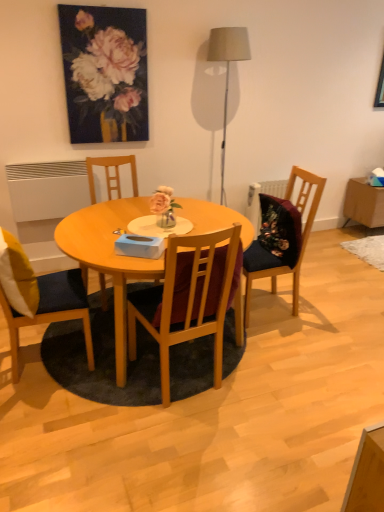
At what (x,y) coordinates should I click in order to perform the action: click on wooden chair at center, which appears as the third chair when viewed from the left. Please return your answer as a coordinate pair (x, y). Looking at the image, I should click on (187, 301).

Describe the element at coordinates (227, 69) in the screenshot. I see `matte gray floor lamp at upper center` at that location.

Locate an element on the screen. Image resolution: width=384 pixels, height=512 pixels. white matte radiator at lower left is located at coordinates (47, 189).

In order to face yellow fabric pillow at left, should I rotate leftwards or rightwards?

Rotate your view left by about 22.286°.

The image size is (384, 512). Describe the element at coordinates (109, 258) in the screenshot. I see `light brown wooden table at center` at that location.

At what (x,y) coordinates should I click in order to perform the action: click on wooden chair at center, which appears as the third chair when viewed from the left. Please return your answer as a coordinate pair (x, y). Looking at the image, I should click on (187, 301).

Is dark blue fabric chair at center, the fourth chair viewed from the left, in front of or behind matte gray floor lamp at upper center in the image?

dark blue fabric chair at center, the fourth chair viewed from the left, is in front of matte gray floor lamp at upper center.

From the picture: From the image's perspective, is dark blue fabric chair at center, acting as the first chair starting from the right, below matte gray floor lamp at upper center?

Correct, dark blue fabric chair at center, acting as the first chair starting from the right, appears lower than matte gray floor lamp at upper center in the image.

Can we say dark blue fabric chair at center, the fourth chair viewed from the left, lies outside matte gray floor lamp at upper center?

Indeed, dark blue fabric chair at center, the fourth chair viewed from the left, is completely outside matte gray floor lamp at upper center.

From a real-world perspective, is dark blue fabric chair at center, acting as the first chair starting from the right, located higher than matte gray floor lamp at upper center?

Actually, dark blue fabric chair at center, acting as the first chair starting from the right, is physically below matte gray floor lamp at upper center in the real world.

Is light brown wooden table at center outside of matte gray floor lamp at upper center?

Yes, light brown wooden table at center is located beyond the bounds of matte gray floor lamp at upper center.

Could you tell me if light brown wooden table at center is facing matte gray floor lamp at upper center?

No, light brown wooden table at center is not aimed at matte gray floor lamp at upper center.

From a real-world perspective, is light brown wooden table at center physically located above or below matte gray floor lamp at upper center?

light brown wooden table at center is situated lower than matte gray floor lamp at upper center in the real world.

Can you confirm if light brown wooden table at center is smaller than matte gray floor lamp at upper center?

No, light brown wooden table at center is not smaller than matte gray floor lamp at upper center.

Measure the distance between dark blue fabric chair at center, acting as the first chair starting from the right, and oil painting at upper center.

dark blue fabric chair at center, acting as the first chair starting from the right, and oil painting at upper center are 5.03 feet apart from each other.

Is dark blue fabric chair at center, acting as the first chair starting from the right, oriented away from oil painting at upper center?

dark blue fabric chair at center, acting as the first chair starting from the right, does not have its back to oil painting at upper center.

Can you confirm if dark blue fabric chair at center, acting as the first chair starting from the right, is positioned to the right of oil painting at upper center?

Yes, dark blue fabric chair at center, acting as the first chair starting from the right, is to the right of oil painting at upper center.

From a real-world perspective, is dark blue fabric chair at center, the fourth chair viewed from the left, under oil painting at upper center?

Indeed, from a real-world perspective, dark blue fabric chair at center, the fourth chair viewed from the left, is positioned beneath oil painting at upper center.

Is matte gray floor lamp at upper center thinner than wooden chair at center, which appears as the third chair when viewed from the left?

Indeed, matte gray floor lamp at upper center has a lesser width compared to wooden chair at center, which appears as the third chair when viewed from the left.

Is matte gray floor lamp at upper center positioned far away from wooden chair at center, the 2th chair when ordered from right to left?

matte gray floor lamp at upper center is positioned a significant distance from wooden chair at center, the 2th chair when ordered from right to left.

I want to click on the 4th chair positioned below the matte gray floor lamp at upper center (from the image's perspective), so click(x=187, y=301).

From a real-world perspective, who is located higher, matte gray floor lamp at upper center or wooden chair at center, which appears as the third chair when viewed from the left?

From a 3D spatial view, matte gray floor lamp at upper center is above.

From the picture: From a real-world perspective, who is located higher, yellow fabric pillow at left or oil painting at upper center?

oil painting at upper center, from a real-world perspective.

Is yellow fabric pillow at left directly adjacent to oil painting at upper center?

No, yellow fabric pillow at left is not touching oil painting at upper center.

Could you tell me if yellow fabric pillow at left is turned towards oil painting at upper center?

No, yellow fabric pillow at left is not turned towards oil painting at upper center.

Which is correct: matte gray floor lamp at upper center is inside dark blue fabric chair at center, the fourth chair viewed from the left, or outside of it?

matte gray floor lamp at upper center is located beyond the bounds of dark blue fabric chair at center, the fourth chair viewed from the left.

What's the angular difference between matte gray floor lamp at upper center and dark blue fabric chair at center, the fourth chair viewed from the left,'s facing directions?

90.7 degrees.

From the image's perspective, is matte gray floor lamp at upper center over dark blue fabric chair at center, the fourth chair viewed from the left?

Yes, from the image's perspective, matte gray floor lamp at upper center is on top of dark blue fabric chair at center, the fourth chair viewed from the left.

From the image's perspective, starting from the matte gray floor lamp at upper center, which chair is the 2nd one below? Please provide its 2D coordinates.

[(300, 240)]

Is oil painting at upper center situated inside wooden side table at right or outside?

oil painting at upper center is outside wooden side table at right.

Is oil painting at upper center beside wooden side table at right?

No, oil painting at upper center is not beside wooden side table at right.

Considering the positions of points (77, 57) and (360, 199), is point (77, 57) farther from camera compared to point (360, 199)?

That is False.

Relative to wooden side table at right, is oil painting at upper center in front or behind?

Clearly, oil painting at upper center is in front of wooden side table at right.

The width and height of the screenshot is (384, 512). In order to click on the 2nd chair below the matte gray floor lamp at upper center (from the image's perspective) in this screenshot , I will do `click(300, 240)`.

Find the location of a particular element. The width and height of the screenshot is (384, 512). desk in front of the matte gray floor lamp at upper center is located at coordinates (109, 258).

Which object lies further to the anchor point wooden chair at center, which appears as the third chair when viewed from the right, yellow fabric pillow at left or matte gray floor lamp at upper center?

matte gray floor lamp at upper center is positioned further to the anchor wooden chair at center, which appears as the third chair when viewed from the right.

Based on their spatial positions, is matte gray floor lamp at upper center or white matte radiator at lower left closer to wooden chair at center, the 2th chair when ordered from right to left?

Among the two, white matte radiator at lower left is located nearer to wooden chair at center, the 2th chair when ordered from right to left.

Which object lies nearer to the anchor point oil painting at upper center, wooden chair at left, the 1th chair positioned from the left, or dark blue fabric chair at center, the fourth chair viewed from the left?

wooden chair at left, the 1th chair positioned from the left.

Consider the image. Estimate the real-world distances between objects in this image. Which object is further from yellow fabric pillow at left, wooden chair at center, the 2th chair when ordered from right to left, or light brown wooden table at center?

wooden chair at center, the 2th chair when ordered from right to left, lies further to yellow fabric pillow at left than the other object.

Estimate the real-world distances between objects in this image. Which object is further from wooden side table at right, wooden chair at center, which appears as the third chair when viewed from the left, or light brown wooden table at center?

Based on the image, wooden chair at center, which appears as the third chair when viewed from the left, appears to be further to wooden side table at right.

When comparing their distances from light brown wooden table at center, does wooden chair at center, the second chair viewed from the left, or white matte radiator at lower left seem closer?

Based on the image, wooden chair at center, the second chair viewed from the left, appears to be nearer to light brown wooden table at center.

Looking at the image, which one is located further to matte gray floor lamp at upper center, wooden chair at center, the second chair viewed from the left, or oil painting at upper center?

wooden chair at center, the second chair viewed from the left, is positioned further to the anchor matte gray floor lamp at upper center.

When comparing their distances from wooden chair at center, which appears as the third chair when viewed from the right, does oil painting at upper center or light brown wooden table at center seem further?

Based on the image, light brown wooden table at center appears to be further to wooden chair at center, which appears as the third chair when viewed from the right.

At what (x,y) coordinates should I click in order to perform the action: click on desk situated between wooden chair at center, the second chair viewed from the left, and wooden side table at right from left to right. Please return your answer as a coordinate pair (x, y). This screenshot has height=512, width=384. Looking at the image, I should click on pos(109,258).

Find the location of a particular element. The image size is (384, 512). pillow between oil painting at upper center and wooden chair at left, positioned as the 4th chair in right-to-left order, in the vertical direction is located at coordinates (17, 276).

Find the location of a particular element. lamp between wooden chair at left, positioned as the 4th chair in right-to-left order, and dark blue fabric chair at center, the fourth chair viewed from the left, in the horizontal direction is located at coordinates (227, 69).

The width and height of the screenshot is (384, 512). In order to click on picture frame located between wooden chair at left, the 1th chair positioned from the left, and wooden side table at right in the left-right direction in this screenshot , I will do `click(105, 73)`.